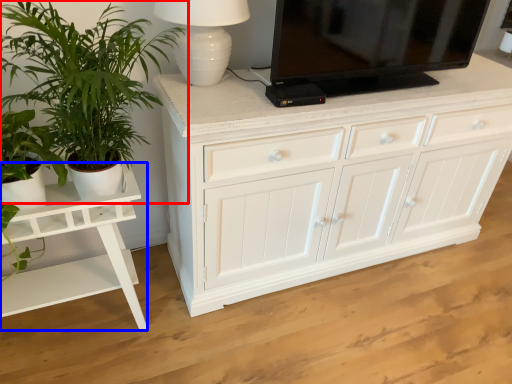
Question: Among these objects, which one is nearest to the camera, houseplant (highlighted by a red box) or table (highlighted by a blue box)?

Choices:
 (A) houseplant
 (B) table

Answer: (A)